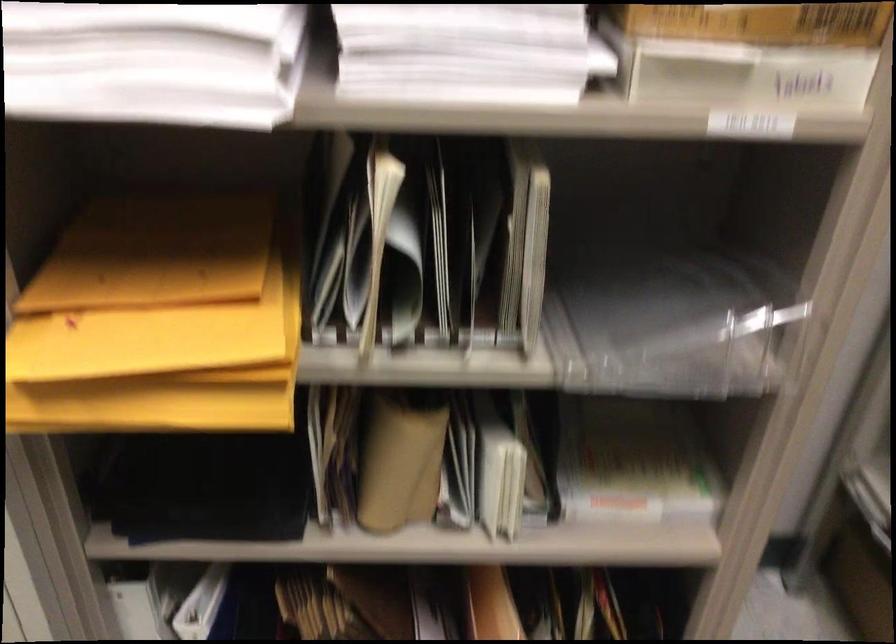
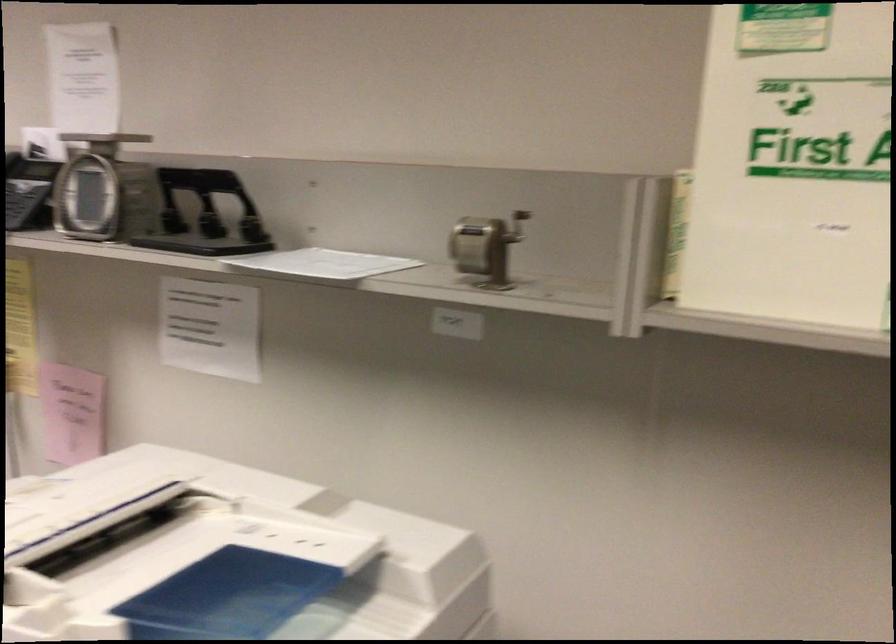
The first image is from the beginning of the video and the second image is from the end. How did the camera likely rotate when shooting the video?

The camera's rotation is toward right-down.